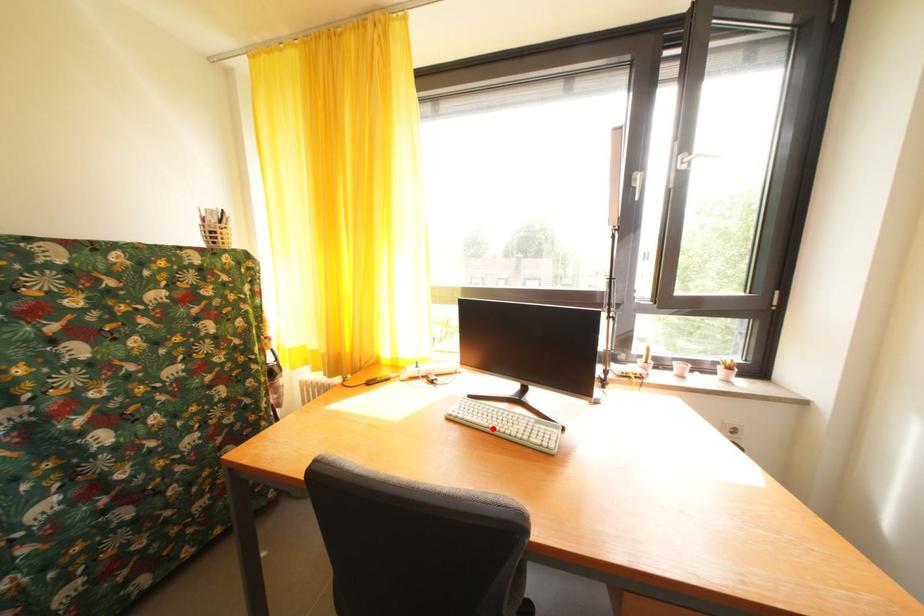
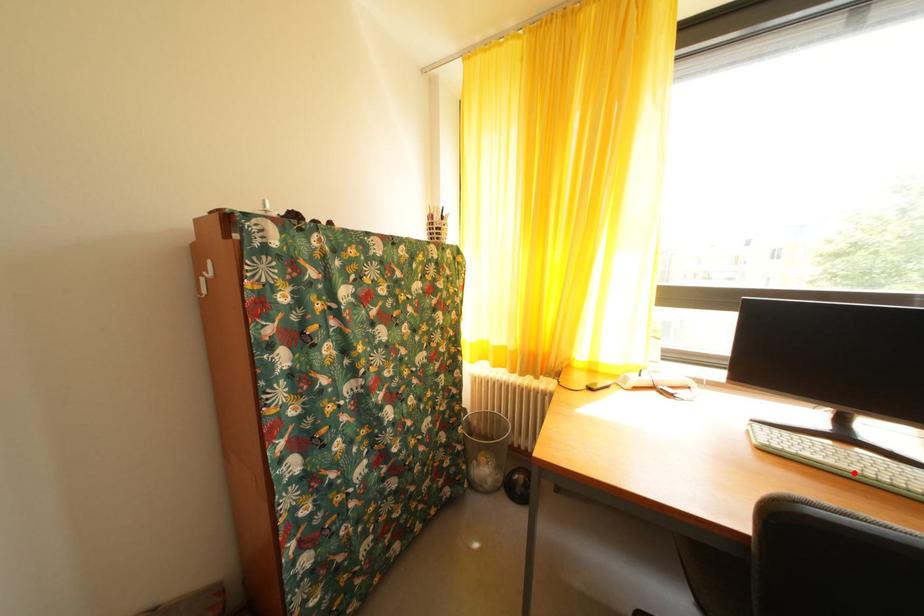
I am providing you with two images of the same scene from different viewpoints. A red point is marked on the first image and another point is marked on the second image. Is the red point in image1 aligned with the point shown in image2?

Yes